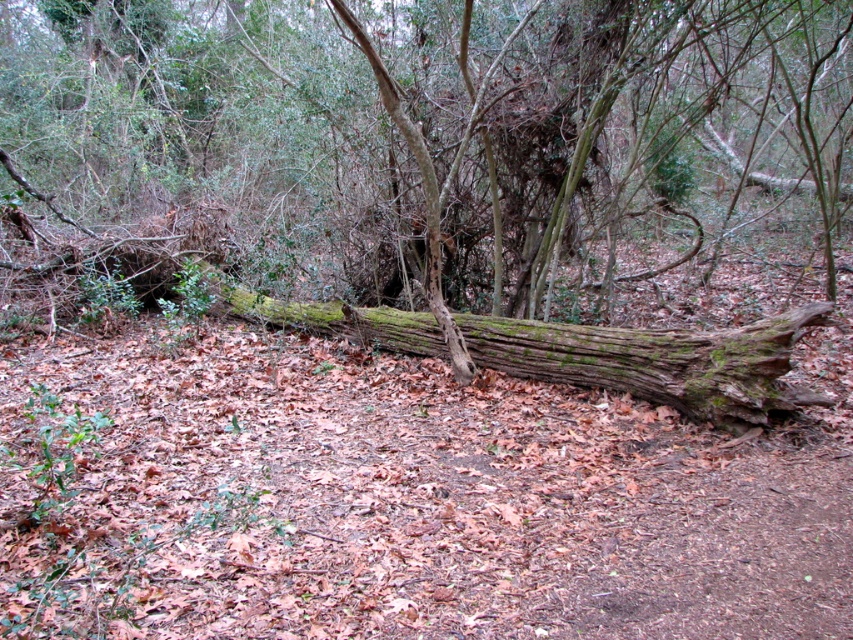
Does green mossy log at center have a greater width compared to green mossy wood at center?

Indeed, green mossy log at center has a greater width compared to green mossy wood at center.

Consider the image. Who is higher up, green mossy log at center or green mossy wood at center?

Positioned higher is green mossy log at center.

Find the location of a particular element. green mossy log at center is located at coordinates (422, 141).